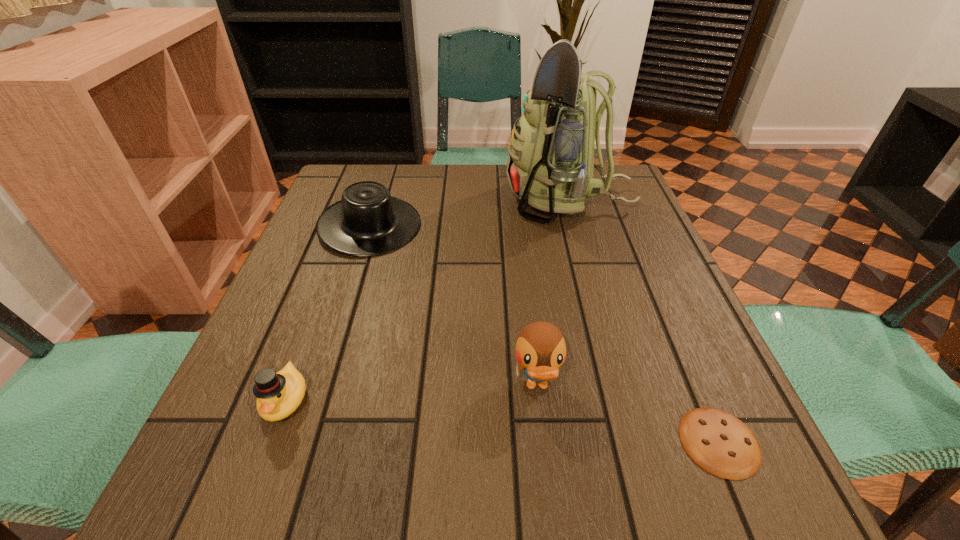
Identify the location of object located in the far left corner section of the desktop. (367, 221).

Locate an element on the screen. object located in the far right corner section of the desktop is located at coordinates (550, 162).

Locate an element on the screen. This screenshot has height=540, width=960. object situated at the near right corner is located at coordinates (721, 444).

Image resolution: width=960 pixels, height=540 pixels. In order to click on free point at the far edge in this screenshot , I will do `click(443, 179)`.

The image size is (960, 540). In the image, there is a desktop. In order to click on free region at the near edge in this screenshot , I will do `click(361, 459)`.

You are a GUI agent. You are given a task and a screenshot of the screen. Output one action in this format:
    pyautogui.click(x=<x>, y=<y>)
    Task: Click on the free spot at the left edge of the desktop
    
    Given the screenshot: What is the action you would take?
    pyautogui.click(x=249, y=370)

Identify the location of vacant region at the right edge of the desktop. This screenshot has width=960, height=540. (698, 317).

Find the location of `vacant space at the far left corner of the desktop`. vacant space at the far left corner of the desktop is located at coordinates (343, 164).

Find the location of `vacant space at the far right corner of the desktop`. vacant space at the far right corner of the desktop is located at coordinates (619, 206).

In order to click on vacant region between the dress hat and the right duck in this screenshot , I will do `click(453, 306)`.